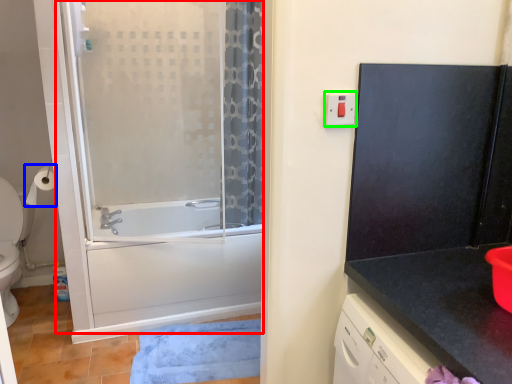
Question: Based on their relative distances, which object is nearer to screen door (highlighted by a red box)? Choose from toilet paper (highlighted by a blue box) and electric outlet (highlighted by a green box).

Choices:
 (A) toilet paper
 (B) electric outlet

Answer: (A)